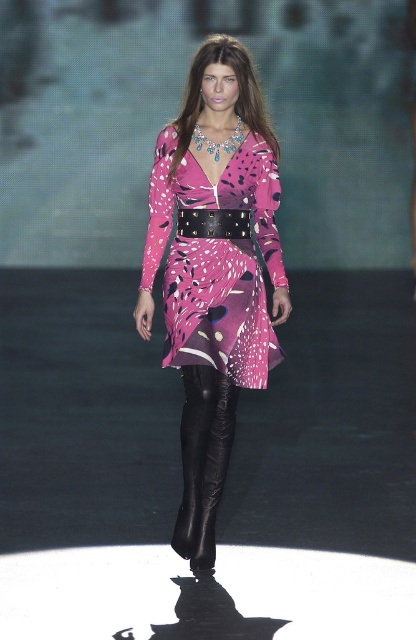
Between pink printed fabric dress at center and black leather pants at center, which one is positioned lower?

black leather pants at center is below.

Image resolution: width=416 pixels, height=640 pixels. What do you see at coordinates (217, 308) in the screenshot? I see `pink printed fabric dress at center` at bounding box center [217, 308].

What are the coordinates of `pink printed fabric dress at center` in the screenshot? It's located at (217, 308).

From the picture: Is pink printed fabric dress at center thinner than black leather belt at center?

In fact, pink printed fabric dress at center might be wider than black leather belt at center.

Who is taller, pink printed fabric dress at center or black leather belt at center?

Standing taller between the two is pink printed fabric dress at center.

Locate an element on the screen. The image size is (416, 640). pink printed fabric dress at center is located at coordinates (217, 308).

Is point (269, 128) positioned after point (212, 314)?

Yes, it is behind point (212, 314).

I want to click on pink satin dress at center, so click(213, 273).